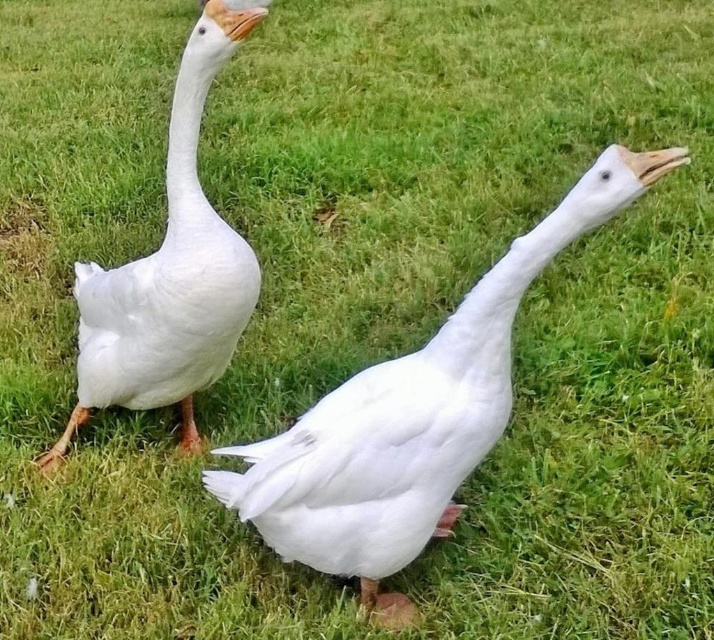
You are a photographer trying to capture both the white matte duck at center and the white matte duck at left in a single shot. Which duck will appear closer to the camera in the photo?

The white matte duck at center will appear closer to the camera because it is positioned in front of the white matte duck at left.